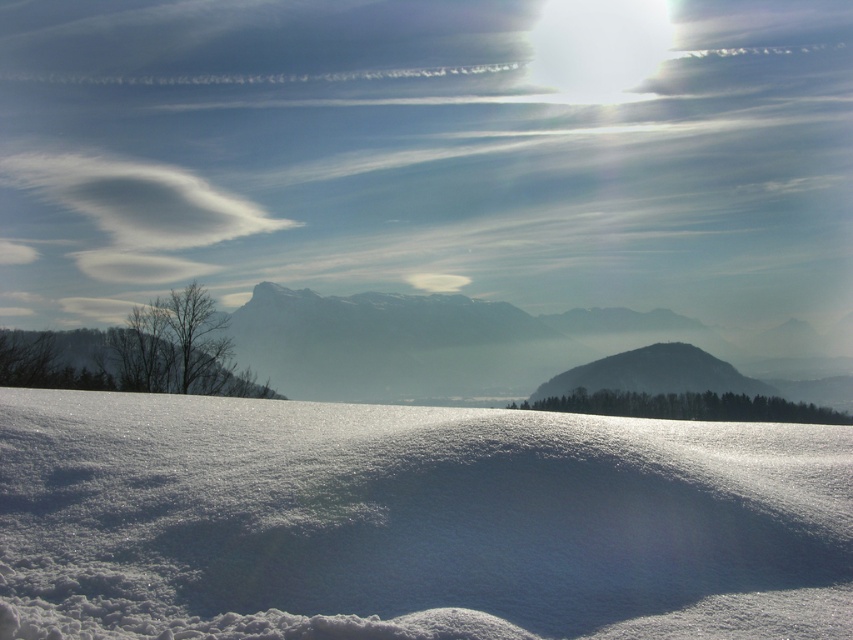
Is white cotton cloud at upper left closer to camera compared to smooth gray rock at center?

No.

Is point (146, 250) positioned in front of point (672, 371)?

No, it is behind (672, 371).

The image size is (853, 640). Identify the location of white cotton cloud at upper left. (137, 212).

Identify the location of white cotton cloud at upper left. This screenshot has width=853, height=640. (137, 212).

Is white fluffy snow at center positioned behind white cotton cloud at upper left?

No.

Identify the location of white fluffy snow at center. The image size is (853, 640). (415, 522).

Who is more distant from viewer, (840,243) or (189,232)?

The point (189,232) is more distant.

Does white fluffy cloud at upper center appear under white cotton cloud at upper left?

No.

At what (x,y) coordinates should I click in order to perform the action: click on white fluffy cloud at upper center. Please return your answer as a coordinate pair (x, y). The width and height of the screenshot is (853, 640). Looking at the image, I should click on (428, 152).